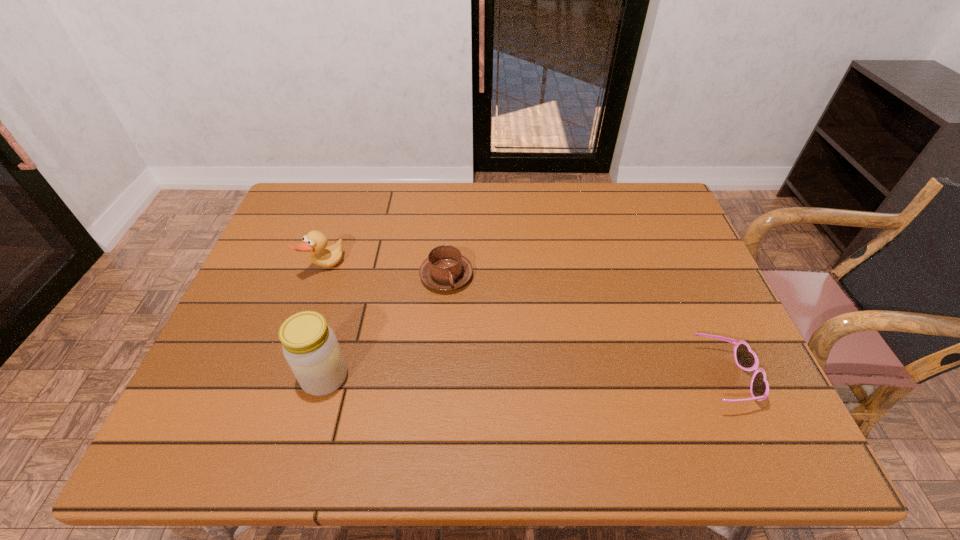
The height and width of the screenshot is (540, 960). I want to click on vacant space on the desktop that is between the jar and the shortest object and is positioned on the beak of the third shortest object, so click(486, 378).

Where is `free space on the desktop that is between the tallest object and the sunglasses and is positioned on the side of the third object from left to right with the handle`? The image size is (960, 540). free space on the desktop that is between the tallest object and the sunglasses and is positioned on the side of the third object from left to right with the handle is located at coordinates (547, 379).